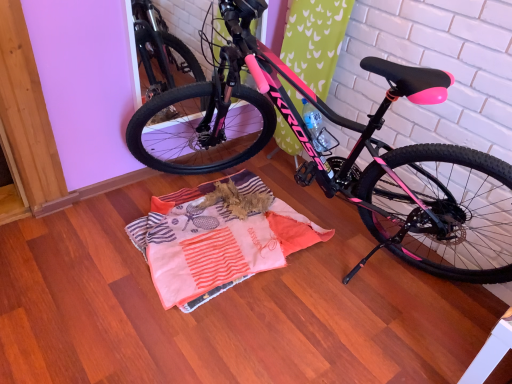
Question: Is striped cotton blanket at center smaller than pink matte bicycle at center?

Choices:
 (A) no
 (B) yes

Answer: (B)

Question: Would you consider striped cotton blanket at center to be distant from pink matte bicycle at center?

Choices:
 (A) yes
 (B) no

Answer: (B)

Question: From the image's perspective, would you say striped cotton blanket at center is positioned over pink matte bicycle at center?

Choices:
 (A) no
 (B) yes

Answer: (A)

Question: Is striped cotton blanket at center closer to the viewer compared to pink matte bicycle at center?

Choices:
 (A) yes
 (B) no

Answer: (B)

Question: Can you confirm if striped cotton blanket at center is positioned to the left of pink matte bicycle at center?

Choices:
 (A) yes
 (B) no

Answer: (A)

Question: Is striped cotton blanket at center thinner than pink matte bicycle at center?

Choices:
 (A) no
 (B) yes

Answer: (B)

Question: From the image's perspective, is pink matte bicycle at center under striped cotton blanket at center?

Choices:
 (A) no
 (B) yes

Answer: (A)

Question: Is pink matte bicycle at center looking in the opposite direction of striped cotton blanket at center?

Choices:
 (A) yes
 (B) no

Answer: (B)

Question: Is striped cotton blanket at center inside pink matte bicycle at center?

Choices:
 (A) no
 (B) yes

Answer: (B)

Question: Does pink matte bicycle at center have a smaller size compared to striped cotton blanket at center?

Choices:
 (A) yes
 (B) no

Answer: (B)

Question: From a real-world perspective, is pink matte bicycle at center located higher than striped cotton blanket at center?

Choices:
 (A) no
 (B) yes

Answer: (B)

Question: Is pink matte bicycle at center positioned before striped cotton blanket at center?

Choices:
 (A) no
 (B) yes

Answer: (B)

Question: Looking at their shapes, would you say striped cotton blanket at center is wider or thinner than pink matte bicycle at center?

Choices:
 (A) wide
 (B) thin

Answer: (B)